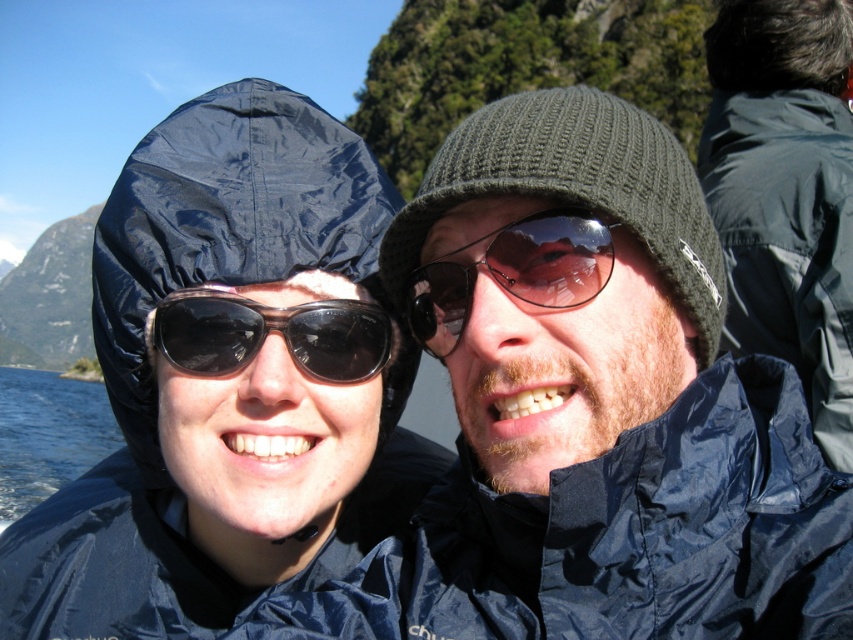
Question: Is navy blue waterproof jacket at center further to the viewer compared to sunglasses at center?

Choices:
 (A) no
 (B) yes

Answer: (A)

Question: Can you confirm if navy blue waterproof jacket at center is smaller than dark blue nylon jacket at upper right?

Choices:
 (A) yes
 (B) no

Answer: (A)

Question: Which object is the farthest from the matte black raincoat at left?

Choices:
 (A) black reflective sunglasses at center
 (B) matte blue jacket at center

Answer: (B)

Question: Estimate the real-world distances between objects in this image. Which object is closer to the matte black raincoat at left?

Choices:
 (A) black reflective sunglasses at center
 (B) knitted dark green beanie at center
 (C) sunglasses at center
 (D) matte blue jacket at center

Answer: (A)

Question: Is dark blue nylon jacket at upper right above blue water at lower left?

Choices:
 (A) no
 (B) yes

Answer: (B)

Question: Estimate the real-world distances between objects in this image. Which object is farther from the black reflective sunglasses at center?

Choices:
 (A) knitted dark green beanie at center
 (B) dark blue nylon jacket at upper right
 (C) matte blue jacket at center

Answer: (B)